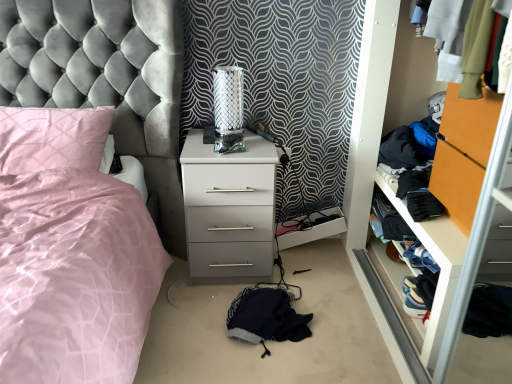
The height and width of the screenshot is (384, 512). In order to click on vacant area in front of fuzzy dark blue blanket at lower center, which is the 3th clothing from top to bottom in this screenshot , I will do `click(267, 369)`.